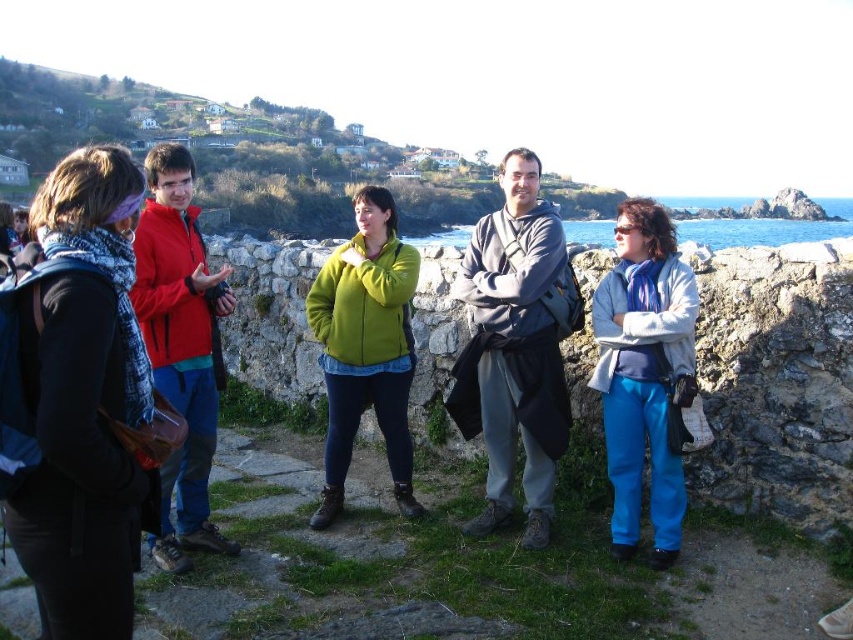
You are standing in the coastal area and want to take a photo of both point (x=498, y=477) and point (x=640, y=243) in the background. Since you want both points to be clearly visible, which point should you focus on to ensure the other is also in focus?

You should focus on point (x=640, y=243) because it is closer to you than point (x=498, y=477). By focusing on the closer point, the further point will still be within the depth of field and remain in focus.

You are a photographer trying to capture a group photo of the individuals in the scene. You notice the blue scarf at left and the gray hoodie at center. Which clothing item should you adjust to ensure both are fully visible in the frame?

The blue scarf at left is shorter than the gray hoodie at center. To ensure both are fully visible, you should adjust the blue scarf at left so it is positioned higher or the gray hoodie at center lowered slightly.

You are a photographer trying to capture a group photo of the five people. The gray hoodie at center and blue fabric pants at center are overlapping in the current composition. Which clothing item should you ask the person to adjust so that the other item is fully visible?

The gray hoodie at center is bigger than blue fabric pants at center. To ensure the blue fabric pants at center are fully visible, the person wearing them should adjust the gray hoodie at center to avoid overlapping.